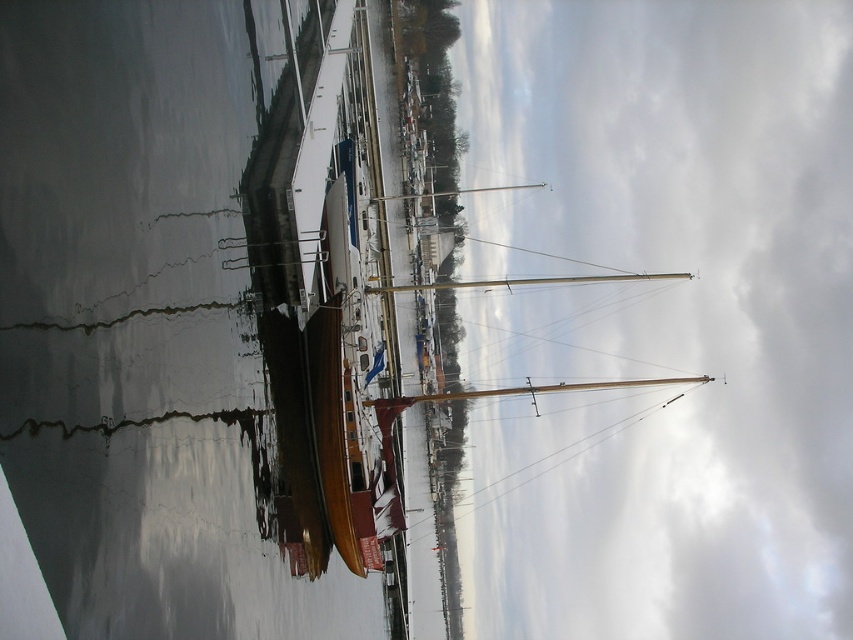
Question: Which point appears farthest from the camera in this image?

Choices:
 (A) (672, 381)
 (B) (16, 113)
 (C) (451, 189)

Answer: (C)

Question: Which of the following is the farthest from the observer?

Choices:
 (A) pyautogui.click(x=534, y=202)
 (B) pyautogui.click(x=421, y=193)
 (C) pyautogui.click(x=227, y=444)
 (D) pyautogui.click(x=404, y=397)

Answer: (A)

Question: Is silver metallic mast at center bigger than polished wood mast at center?

Choices:
 (A) no
 (B) yes

Answer: (A)

Question: Which point is closer to the camera?

Choices:
 (A) white cloudy sky at upper center
 (B) glossy water at lower left
 (C) polished wood mast at center
 (D) wooden mast at center

Answer: (B)

Question: Observing the image, what is the correct spatial positioning of white cloudy sky at upper center in reference to polished wood mast at center?

Choices:
 (A) above
 (B) below

Answer: (B)

Question: Is white cloudy sky at upper center further to the viewer compared to silver metallic mast at center?

Choices:
 (A) yes
 (B) no

Answer: (A)